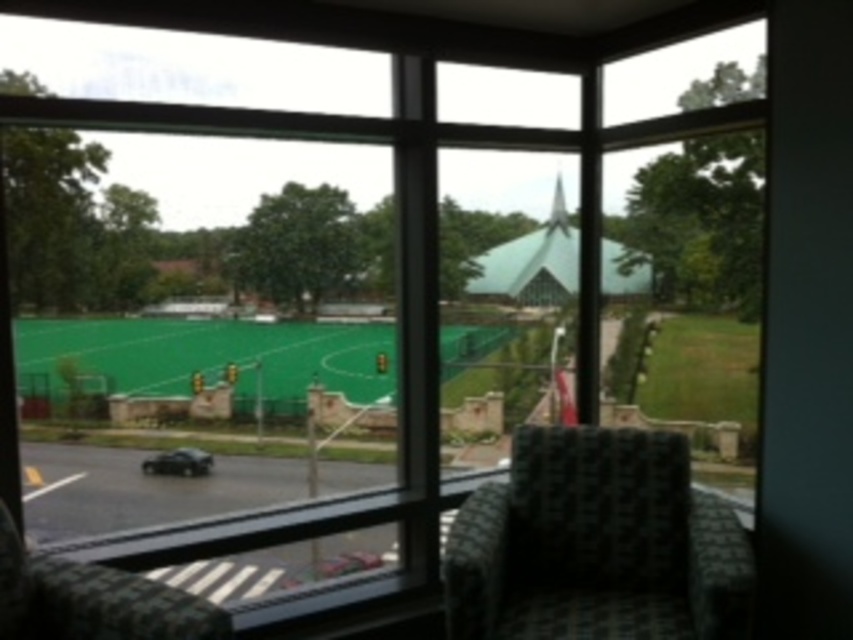
Question: Is dark green woven armchair at lower right below shiny black car at lower left?

Choices:
 (A) no
 (B) yes

Answer: (A)

Question: Estimate the real-world distances between objects in this image. Which object is farther from the patterned fabric chair at lower left?

Choices:
 (A) green artificial turf at center
 (B) shiny black car at lower left
 (C) dark green woven armchair at lower right

Answer: (B)

Question: Which object is farther from the camera taking this photo?

Choices:
 (A) dark green woven armchair at lower right
 (B) patterned fabric chair at lower left
 (C) shiny black car at lower left

Answer: (C)

Question: Which of these objects is positioned farthest from the dark green woven armchair at lower right?

Choices:
 (A) shiny black car at lower left
 (B) patterned fabric chair at lower left
 (C) green artificial turf at center

Answer: (A)

Question: Can you confirm if dark green woven armchair at lower right is smaller than patterned fabric chair at lower left?

Choices:
 (A) no
 (B) yes

Answer: (A)

Question: Does dark green woven armchair at lower right have a lesser width compared to patterned fabric chair at lower left?

Choices:
 (A) no
 (B) yes

Answer: (A)